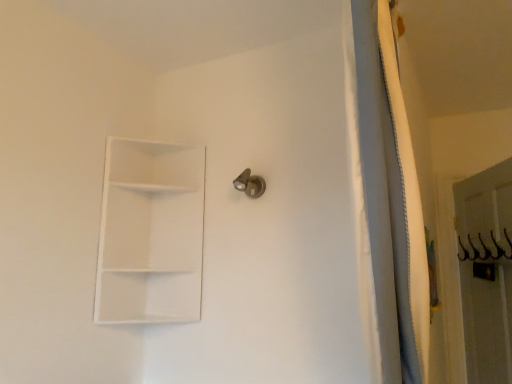
Question: From a real-world perspective, is satin nickel door handle at upper center positioned over white matte shelf at upper left based on gravity?

Choices:
 (A) yes
 (B) no

Answer: (A)

Question: Is satin nickel door handle at upper center located outside white matte shelf at upper left?

Choices:
 (A) yes
 (B) no

Answer: (A)

Question: From a real-world perspective, does satin nickel door handle at upper center sit lower than white matte shelf at upper left?

Choices:
 (A) yes
 (B) no

Answer: (B)

Question: Is satin nickel door handle at upper center facing away from white matte shelf at upper left?

Choices:
 (A) no
 (B) yes

Answer: (A)

Question: Can you confirm if satin nickel door handle at upper center is shorter than white matte shelf at upper left?

Choices:
 (A) no
 (B) yes

Answer: (B)

Question: Can you confirm if satin nickel door handle at upper center is bigger than white matte shelf at upper left?

Choices:
 (A) no
 (B) yes

Answer: (A)

Question: Is white matte shelf at upper left not inside satin nickel door handle at upper center?

Choices:
 (A) yes
 (B) no

Answer: (A)

Question: Is white matte shelf at upper left positioned behind satin nickel door handle at upper center?

Choices:
 (A) no
 (B) yes

Answer: (A)

Question: Would you say white matte shelf at upper left is a long distance from satin nickel door handle at upper center?

Choices:
 (A) yes
 (B) no

Answer: (B)

Question: Considering the relative sizes of white matte shelf at upper left and satin nickel door handle at upper center in the image provided, is white matte shelf at upper left taller than satin nickel door handle at upper center?

Choices:
 (A) yes
 (B) no

Answer: (A)

Question: Considering the relative sizes of white matte shelf at upper left and satin nickel door handle at upper center in the image provided, is white matte shelf at upper left wider than satin nickel door handle at upper center?

Choices:
 (A) no
 (B) yes

Answer: (B)

Question: Does white matte shelf at upper left have a lesser height compared to satin nickel door handle at upper center?

Choices:
 (A) no
 (B) yes

Answer: (A)

Question: Considering the positions of point (265, 187) and point (117, 192), is point (265, 187) closer or farther from the camera than point (117, 192)?

Choices:
 (A) closer
 (B) farther

Answer: (A)